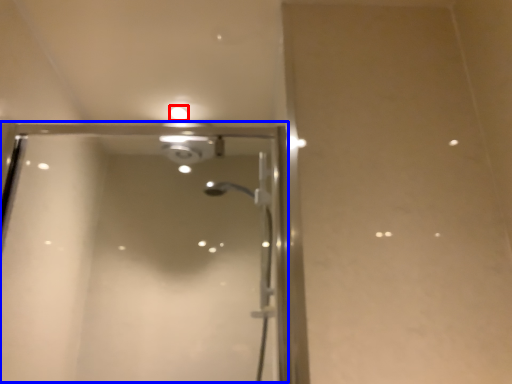
Question: Which point is closer to the camera, droplight (highlighted by a red box) or screen door (highlighted by a blue box)?

Choices:
 (A) droplight
 (B) screen door

Answer: (B)